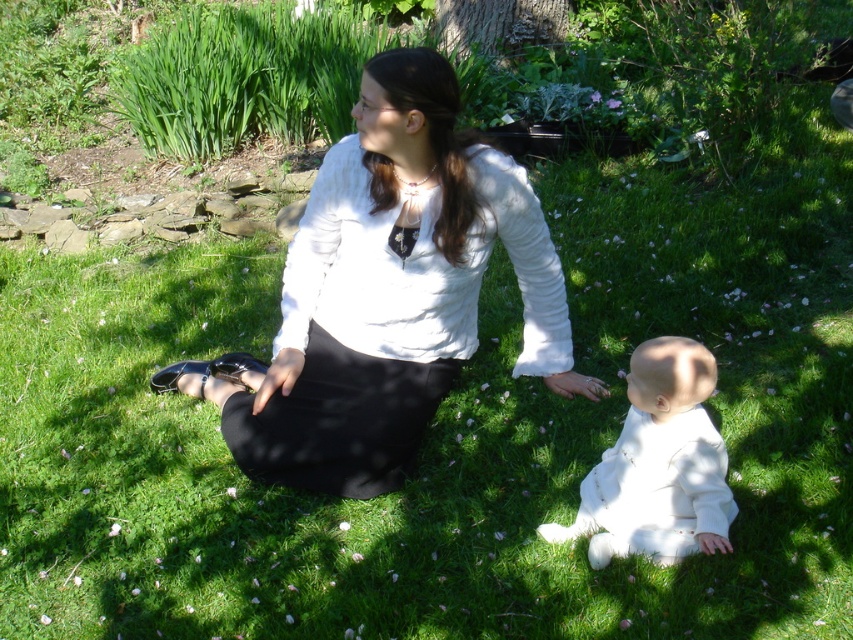
Which of these two, white matte blouse at center or white soft fabric baby at lower right, stands shorter?

Standing shorter between the two is white soft fabric baby at lower right.

Does point (309, 413) come farther from viewer compared to point (637, 360)?

Yes, point (309, 413) is farther from viewer.

Between point (451, 212) and point (668, 417), which one is positioned behind?

Point (451, 212)

You are a GUI agent. You are given a task and a screenshot of the screen. Output one action in this format:
    pyautogui.click(x=<x>, y=<y>)
    Task: Click on the white matte blouse at center
    The image size is (853, 640).
    Given the screenshot: What is the action you would take?
    pyautogui.click(x=387, y=292)